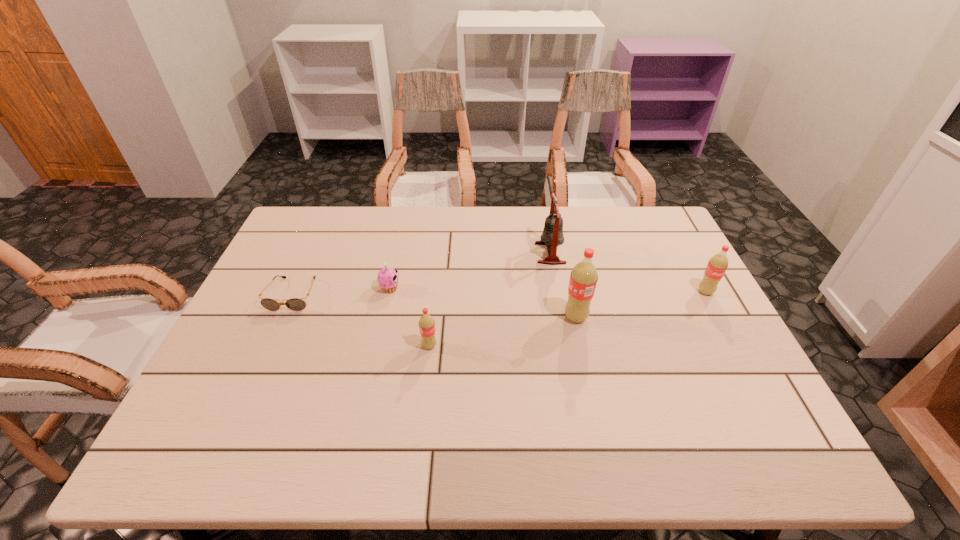
You are a GUI agent. You are given a task and a screenshot of the screen. Output one action in this format:
    pyautogui.click(x=<x>, y=<y>)
    Task: Click on the fourth object from right to left
    
    Given the screenshot: What is the action you would take?
    pyautogui.click(x=426, y=323)

Locate an element on the screen. the fourth tallest object is located at coordinates (426, 323).

At what (x,y) coordinates should I click in order to perform the action: click on the second soda from right to left. Please return your answer as a coordinate pair (x, y). The height and width of the screenshot is (540, 960). Looking at the image, I should click on (583, 278).

Identify the location of the second nearest soda. The image size is (960, 540). (583, 278).

I want to click on the second tallest soda, so click(717, 265).

Identify the location of the rightmost object. (717, 265).

Where is `the second shortest object`? This screenshot has height=540, width=960. the second shortest object is located at coordinates (387, 278).

Identify the location of cupcake. (387, 278).

The height and width of the screenshot is (540, 960). I want to click on sunglasses, so click(x=295, y=304).

The height and width of the screenshot is (540, 960). In order to click on the shortest object in this screenshot , I will do `click(295, 304)`.